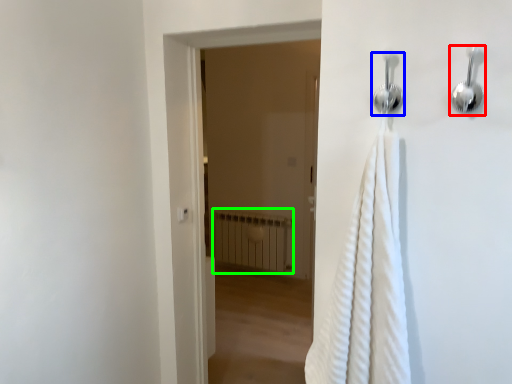
Question: Estimate the real-world distances between objects in this image. Which object is closer to shower (highlighted by a red box), shower (highlighted by a blue box) or radiator (highlighted by a green box)?

Choices:
 (A) shower
 (B) radiator

Answer: (A)